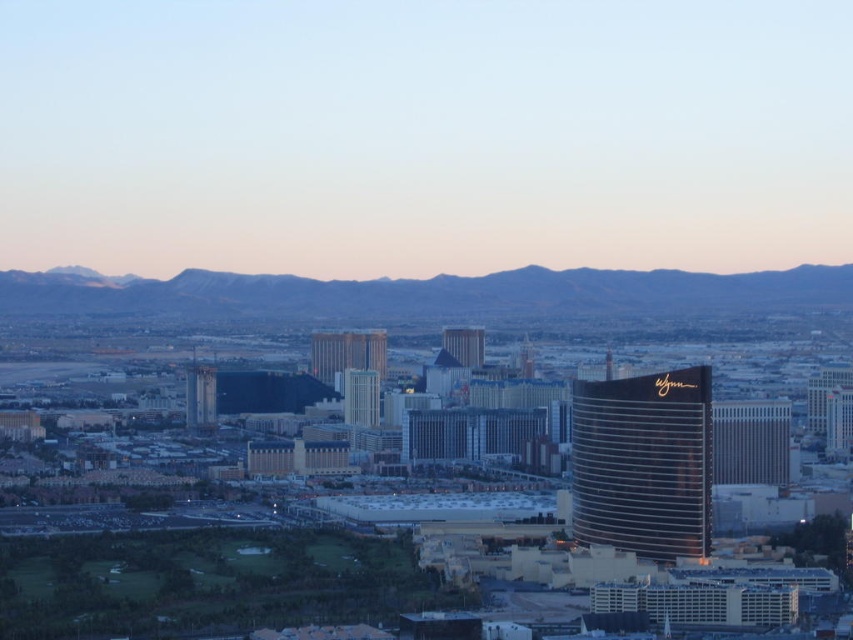
Between gray rocky mountains at center and shiny gold hotel at center right, which one appears on the left side from the viewer's perspective?

gray rocky mountains at center

Locate an element on the screen. The height and width of the screenshot is (640, 853). gray rocky mountains at center is located at coordinates (430, 292).

Image resolution: width=853 pixels, height=640 pixels. Identify the location of gray rocky mountains at center. (430, 292).

Which is more to the left, gray rocky mountains at center or metallic silver hotel at right?

gray rocky mountains at center is more to the left.

Between point (672, 280) and point (788, 429), which one is positioned behind?

Positioned behind is point (788, 429).

Is point (389, 291) closer to camera compared to point (759, 442)?

Yes, it is in front of point (759, 442).

Where is `gray rocky mountains at center`? The image size is (853, 640). gray rocky mountains at center is located at coordinates (430, 292).

Does shiny gold hotel at center right appear over metallic silver hotel at right?

No.

Does shiny gold hotel at center right have a greater height compared to metallic silver hotel at right?

Yes, shiny gold hotel at center right is taller than metallic silver hotel at right.

At what (x,y) coordinates should I click in order to perform the action: click on shiny gold hotel at center right. Please return your answer as a coordinate pair (x, y). Looking at the image, I should click on click(x=643, y=464).